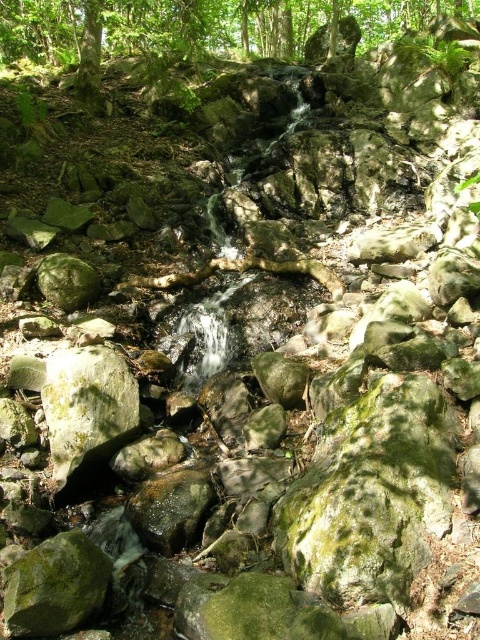
You are a hiker standing at the base of the green leafy tree at upper center and want to reach the green mossy rock at center. Which direction should you walk to get there?

The green mossy rock at center is located below the green leafy tree at upper center. Since the tree is much taller, you should walk downward towards the green mossy rock at center.

You are standing at the origin point in the image. Which direction should you move to reach the green leafy tree at upper center?

The green leafy tree at upper center is located at coordinates approximately 0.039 on the x axis and 0.423 on the y axis. Since you are at the origin point, you should move towards the upper center direction to reach it.